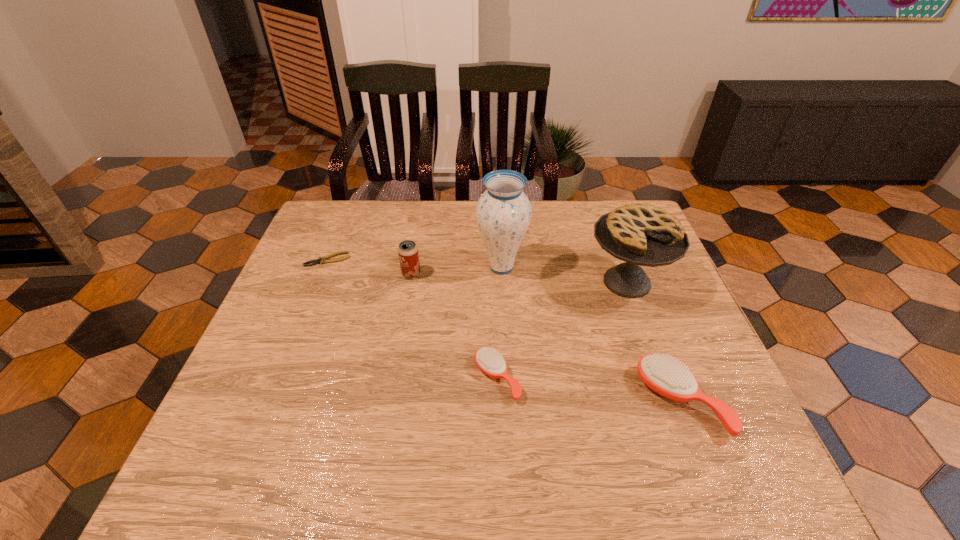
Locate an element on the screen. the left hairbrush is located at coordinates point(488,360).

Locate an element on the screen. This screenshot has width=960, height=540. the shorter hairbrush is located at coordinates (488, 360).

Find the location of a particular element. This screenshot has height=540, width=960. the third shortest object is located at coordinates pos(668,378).

Identify the location of the right hairbrush. (668, 378).

What are the coordinates of `the third tallest object` in the screenshot? It's located at click(408, 254).

Where is `beer can`? beer can is located at coordinates (408, 254).

This screenshot has height=540, width=960. What are the coordinates of `the fifth shortest object` in the screenshot? It's located at (640, 234).

Identify the location of the shortest object. (321, 260).

The width and height of the screenshot is (960, 540). I want to click on the leftmost object, so click(321, 260).

Where is `vase`? This screenshot has width=960, height=540. vase is located at coordinates (503, 213).